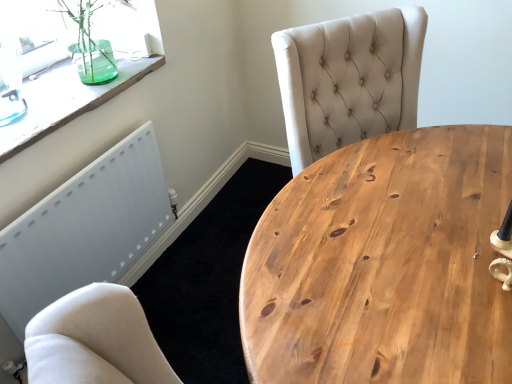
Question: Is natural wood table at center taller than transparent glass vase at upper left?

Choices:
 (A) no
 (B) yes

Answer: (B)

Question: Can transparent glass vase at upper left be found inside natural wood table at center?

Choices:
 (A) yes
 (B) no

Answer: (B)

Question: From a real-world perspective, is natural wood table at center below transparent glass vase at upper left?

Choices:
 (A) yes
 (B) no

Answer: (A)

Question: Does natural wood table at center have a smaller size compared to transparent glass vase at upper left?

Choices:
 (A) no
 (B) yes

Answer: (A)

Question: Is natural wood table at center not within transparent glass vase at upper left?

Choices:
 (A) no
 (B) yes

Answer: (B)

Question: From the image's perspective, relative to natural wood table at center, is white matte radiator at lower left above or below?

Choices:
 (A) above
 (B) below

Answer: (B)

Question: Considering the positions of white matte radiator at lower left and natural wood table at center in the image, is white matte radiator at lower left bigger or smaller than natural wood table at center?

Choices:
 (A) big
 (B) small

Answer: (B)

Question: Is white matte radiator at lower left wider or thinner than natural wood table at center?

Choices:
 (A) thin
 (B) wide

Answer: (A)

Question: Is point (148, 168) positioned closer to the camera than point (481, 266)?

Choices:
 (A) farther
 (B) closer

Answer: (A)

Question: From the image's perspective, relative to natural wood table at center, is transparent glass vase at upper left above or below?

Choices:
 (A) above
 (B) below

Answer: (A)

Question: Considering the positions of point (37, 114) and point (475, 352), is point (37, 114) closer or farther from the camera than point (475, 352)?

Choices:
 (A) closer
 (B) farther

Answer: (B)

Question: From a real-world perspective, relative to natural wood table at center, is transparent glass vase at upper left vertically above or below?

Choices:
 (A) above
 (B) below

Answer: (A)

Question: Would you say transparent glass vase at upper left is to the left or to the right of natural wood table at center in the picture?

Choices:
 (A) left
 (B) right

Answer: (A)

Question: Considering their positions, is transparent glass vase at upper left located in front of or behind natural wood table at center?

Choices:
 (A) behind
 (B) front

Answer: (A)

Question: Looking at their shapes, would you say transparent glass vase at upper left is wider or thinner than natural wood table at center?

Choices:
 (A) wide
 (B) thin

Answer: (B)